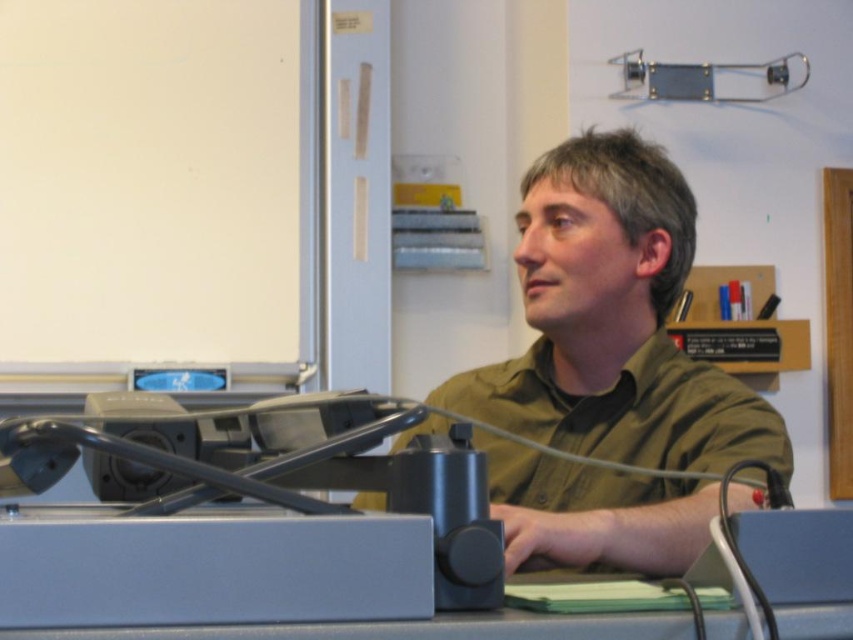
You are a person sitting at the gray matte table at center. You want to reach the green matte shirt at center. Can you move forward without getting off the table?

The gray matte table at center is behind the green matte shirt at center, so moving forward would take you towards the shirt, but since the table is behind you, you cannot move forward without leaving the table.

You are organizing a conference and need to ensure that the green matte shirt at center and the gray matte table at center are visible in the camera frame. Considering their sizes, which object might require adjusting the camera angle to ensure it is fully captured?

The green matte shirt at center has a larger size compared to the gray matte table at center, so adjusting the camera angle might be necessary to fully capture the green matte shirt at center in the frame.